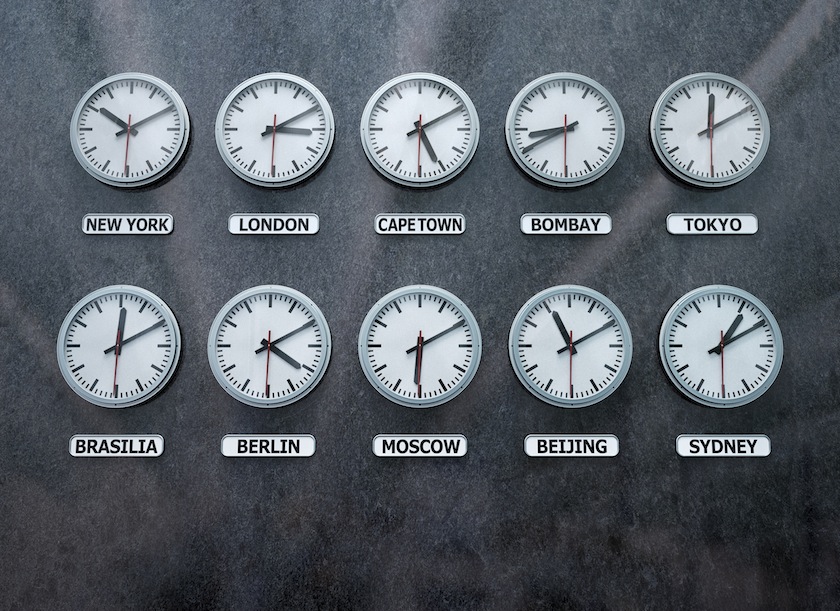
This screenshot has height=611, width=840. Find the location of `clock`. clock is located at coordinates (179, 148).